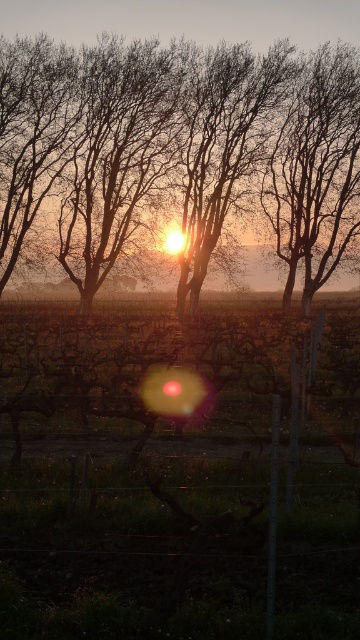
Question: Does silhouette bark tree at center come behind smooth bark tree at center?

Choices:
 (A) no
 (B) yes

Answer: (A)

Question: Which point is farther to the camera?

Choices:
 (A) (303, 76)
 (B) (118, 84)

Answer: (A)

Question: Is silhouette bark tree at center bigger than smooth bark tree at center?

Choices:
 (A) yes
 (B) no

Answer: (A)

Question: Considering the relative positions of silhouette bark tree at center and smooth bark tree at center in the image provided, where is silhouette bark tree at center located with respect to smooth bark tree at center?

Choices:
 (A) below
 (B) above

Answer: (B)

Question: Which object is closer to the camera taking this photo?

Choices:
 (A) smooth bark tree at center
 (B) silhouette bark tree at center

Answer: (B)